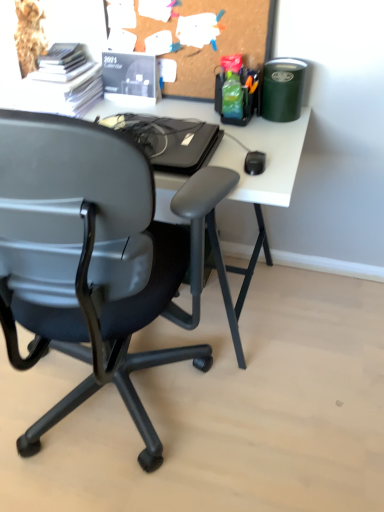
Question: Is white matte computer desk at upper center turned away from white paper stack at upper left, arranged as the 1th stationery when viewed from the left?

Choices:
 (A) yes
 (B) no

Answer: (B)

Question: Would you say white paper stack at upper left, which appears as the fourth stationery when viewed from the right, is part of white matte computer desk at upper center's contents?

Choices:
 (A) no
 (B) yes

Answer: (A)

Question: Can you confirm if white matte computer desk at upper center is bigger than white paper stack at upper left, arranged as the 1th stationery when viewed from the left?

Choices:
 (A) no
 (B) yes

Answer: (B)

Question: Could you tell me if white matte computer desk at upper center is turned towards white paper stack at upper left, arranged as the 1th stationery when viewed from the left?

Choices:
 (A) yes
 (B) no

Answer: (B)

Question: Is white matte computer desk at upper center located outside white paper stack at upper left, which appears as the fourth stationery when viewed from the right?

Choices:
 (A) yes
 (B) no

Answer: (A)

Question: In the image, is matte black calendar at upper center, which ranks as the 3th stationery in right-to-left order, positioned in front of or behind translucent plastic organizer at upper right, acting as the second stationery starting from the right?

Choices:
 (A) front
 (B) behind

Answer: (B)

Question: Is matte black calendar at upper center, which ranks as the 3th stationery in right-to-left order, taller or shorter than translucent plastic organizer at upper right, the 3th stationery from the left?

Choices:
 (A) short
 (B) tall

Answer: (A)

Question: From the image's perspective, is matte black calendar at upper center, the second stationery in the left-to-right sequence, located above or below translucent plastic organizer at upper right, the 3th stationery from the left?

Choices:
 (A) below
 (B) above

Answer: (B)

Question: From a real-world perspective, is matte black calendar at upper center, the second stationery in the left-to-right sequence, above or below translucent plastic organizer at upper right, the 3th stationery from the left?

Choices:
 (A) below
 (B) above

Answer: (A)

Question: Is matte black calendar at upper center, the second stationery in the left-to-right sequence, taller or shorter than green matte trash can at upper right, the 4th stationery in the left-to-right sequence?

Choices:
 (A) short
 (B) tall

Answer: (B)

Question: Looking at their shapes, would you say matte black calendar at upper center, the second stationery in the left-to-right sequence, is wider or thinner than green matte trash can at upper right, which ranks as the 1th stationery in right-to-left order?

Choices:
 (A) thin
 (B) wide

Answer: (A)

Question: Is matte black calendar at upper center, which ranks as the 3th stationery in right-to-left order, to the left or to the right of green matte trash can at upper right, which ranks as the 1th stationery in right-to-left order, in the image?

Choices:
 (A) right
 (B) left

Answer: (B)

Question: From a real-world perspective, is matte black calendar at upper center, the second stationery in the left-to-right sequence, above or below green matte trash can at upper right, the 4th stationery in the left-to-right sequence?

Choices:
 (A) above
 (B) below

Answer: (B)

Question: Considering the relative positions of corkboard at upper center and white matte computer desk at upper center in the image provided, is corkboard at upper center to the left or to the right of white matte computer desk at upper center?

Choices:
 (A) left
 (B) right

Answer: (B)

Question: From the image's perspective, is corkboard at upper center located above or below white matte computer desk at upper center?

Choices:
 (A) above
 (B) below

Answer: (A)